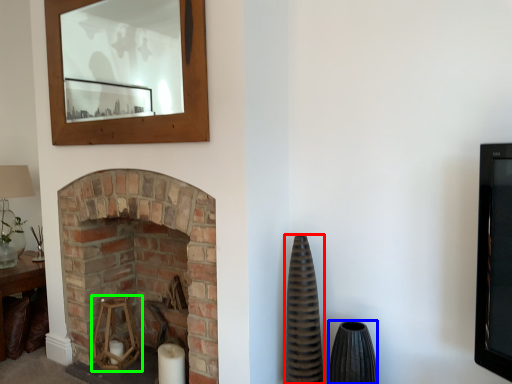
Question: Estimate the real-world distances between objects in this image. Which object is farther from vase (highlighted by a red box), vase (highlighted by a blue box) or candle holder (highlighted by a green box)?

Choices:
 (A) vase
 (B) candle holder

Answer: (B)